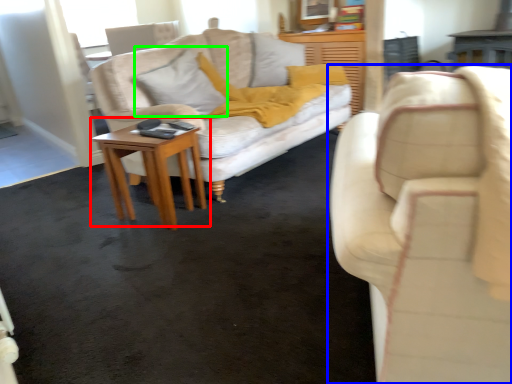
Question: Which object is the closest to the table (highlighted by a red box)? Choose among these: studio couch (highlighted by a blue box) or pillow (highlighted by a green box).

Choices:
 (A) studio couch
 (B) pillow

Answer: (B)